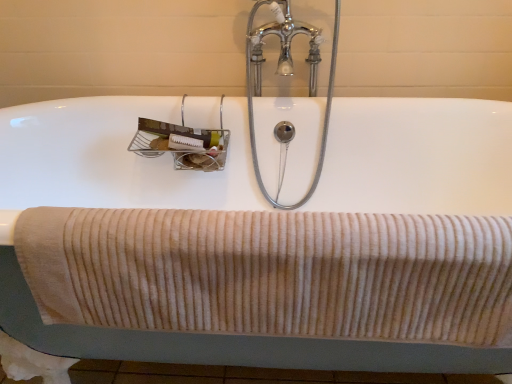
Question: From a real-world perspective, is beige corduroy towel at lower center above or below chrome/metallic faucet at upper center?

Choices:
 (A) above
 (B) below

Answer: (B)

Question: Relative to chrome/metallic faucet at upper center, is beige corduroy towel at lower center in front or behind?

Choices:
 (A) behind
 (B) front

Answer: (B)

Question: Which is farther from the chrome/metallic faucet at upper center?

Choices:
 (A) white ceramic bath at center
 (B) beige corduroy towel at lower center

Answer: (B)

Question: Based on their relative distances, which object is nearer to the chrome/metallic faucet at upper center?

Choices:
 (A) beige corduroy towel at lower center
 (B) white ceramic bath at center

Answer: (B)